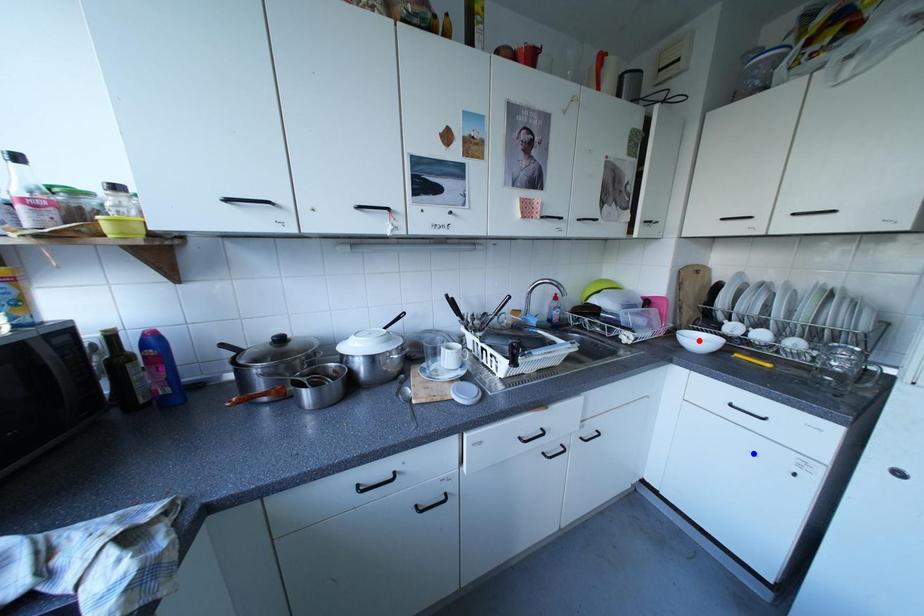
Order these from nearest to farthest:
- red point
- purple point
- blue point

purple point, blue point, red point